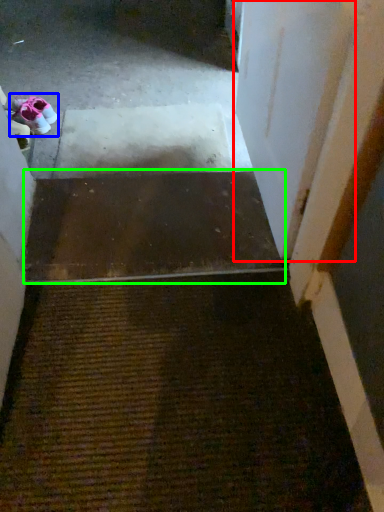
Question: Estimate the real-world distances between objects in this image. Which object is closer to door (highlighted by a red box), footwear (highlighted by a blue box) or stairs (highlighted by a green box)?

Choices:
 (A) footwear
 (B) stairs

Answer: (B)